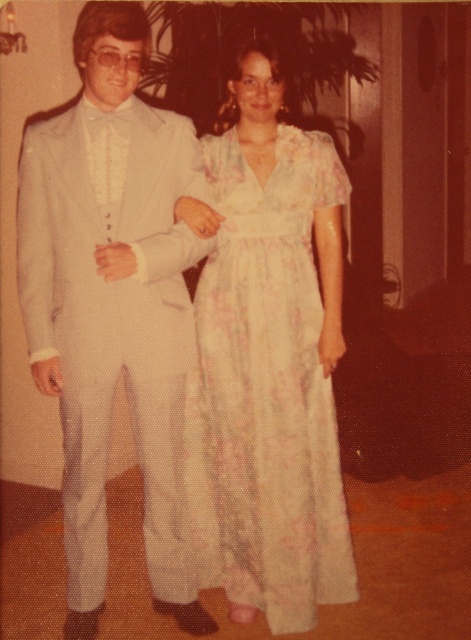
Based on the photo, you are a photographer setting up for a group photo. You have a camera with a lens that can focus on objects within a 12 inch range. The subjects are wearing the matte white suit at left and the floral chiffon dress at center. Can the photographer focus on both subjects simultaneously with this lens?

The matte white suit at left and the floral chiffon dress at center are 14.43 inches apart. Since the distance between them exceeds the 12 inch focus range of the lens, the photographer cannot focus on both subjects simultaneously.

Based on the photo, you are a photographer setting up a shoot for a magazine. You have two outfits to feature in the same frame. The matte white suit at left and the floral chiffon dress at center. Given their sizes, which outfit should be placed closer to the camera to maintain visual balance?

The matte white suit at left is larger in size compared to the floral chiffon dress at center. To maintain visual balance, the smaller floral chiffon dress at center should be placed closer to the camera while the larger matte white suit at left can be positioned slightly further back.